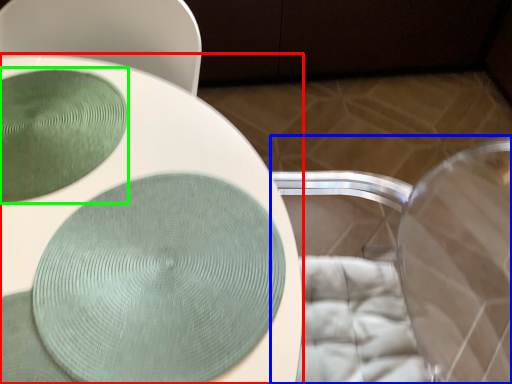
Question: Estimate the real-world distances between objects in this image. Which object is farther from toilet (highlighted by a red box), swivel chair (highlighted by a blue box) or glass plate (highlighted by a green box)?

Choices:
 (A) swivel chair
 (B) glass plate

Answer: (A)